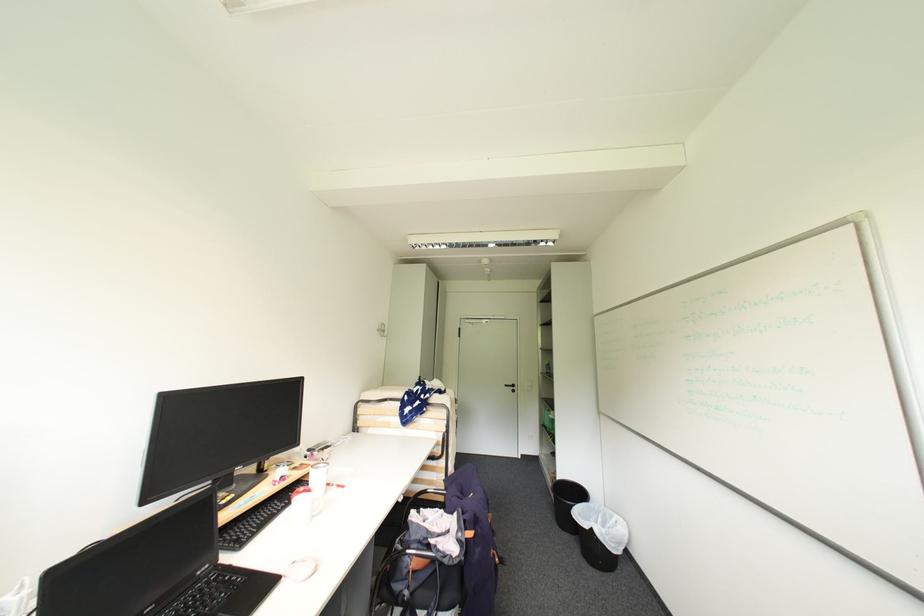
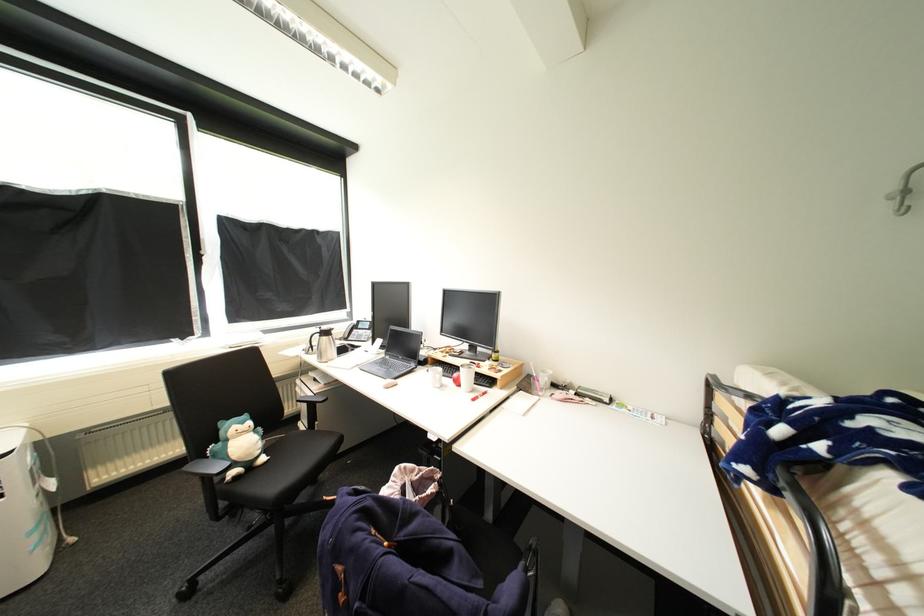
Where in the second image is the point corresponding to point (383, 331) from the first image?

(900, 199)